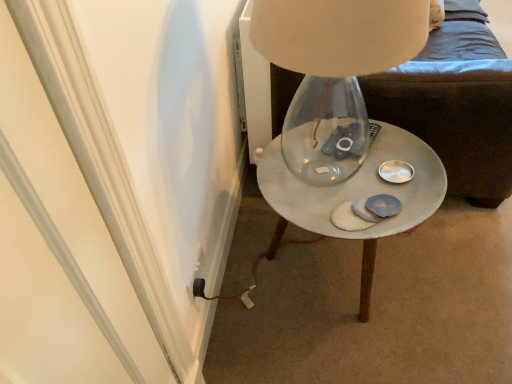
Question: From the image's perspective, does white marble side table at center appear lower than white marble side table at center?

Choices:
 (A) yes
 (B) no

Answer: (B)

Question: Does white marble side table at center come behind white marble side table at center?

Choices:
 (A) no
 (B) yes

Answer: (A)

Question: Is white marble side table at center positioned with its back to white marble side table at center?

Choices:
 (A) no
 (B) yes

Answer: (A)

Question: Does white marble side table at center appear on the left side of white marble side table at center?

Choices:
 (A) yes
 (B) no

Answer: (A)

Question: Does white marble side table at center touch white marble side table at center?

Choices:
 (A) no
 (B) yes

Answer: (A)

Question: Does white marble side table at center have a greater width compared to white marble side table at center?

Choices:
 (A) yes
 (B) no

Answer: (B)

Question: Considering the relative sizes of white marble side table at center and black plastic outlet at lower left in the image provided, is white marble side table at center wider than black plastic outlet at lower left?

Choices:
 (A) no
 (B) yes

Answer: (B)

Question: From the image's perspective, is white marble side table at center beneath black plastic outlet at lower left?

Choices:
 (A) no
 (B) yes

Answer: (A)

Question: Is white marble side table at center smaller than black plastic outlet at lower left?

Choices:
 (A) yes
 (B) no

Answer: (B)

Question: Could black plastic outlet at lower left be considered to be inside white marble side table at center?

Choices:
 (A) yes
 (B) no

Answer: (B)

Question: Considering the relative sizes of white marble side table at center and black plastic outlet at lower left in the image provided, is white marble side table at center taller than black plastic outlet at lower left?

Choices:
 (A) yes
 (B) no

Answer: (A)

Question: Is white marble side table at center not close to black plastic outlet at lower left?

Choices:
 (A) no
 (B) yes

Answer: (A)

Question: Does black plastic outlet at lower left have a greater height compared to white marble side table at center?

Choices:
 (A) no
 (B) yes

Answer: (A)